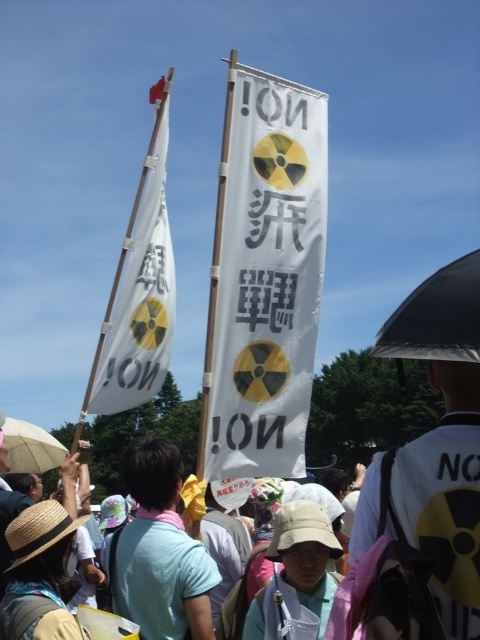
Which of these two, white paper banner at center or white paper flag at upper left, stands taller?

Standing taller between the two is white paper banner at center.

Does white paper banner at center have a smaller size compared to white paper flag at upper left?

No, white paper banner at center is not smaller than white paper flag at upper left.

Image resolution: width=480 pixels, height=640 pixels. What do you see at coordinates (264, 276) in the screenshot?
I see `white paper banner at center` at bounding box center [264, 276].

At what (x,y) coordinates should I click in order to perform the action: click on white paper banner at center. Please return your answer as a coordinate pair (x, y). This screenshot has width=480, height=640. Looking at the image, I should click on (264, 276).

Does white paper banner at center appear on the left side of beige fabric umbrella at lower left?

Incorrect, white paper banner at center is not on the left side of beige fabric umbrella at lower left.

Who is taller, white paper banner at center or beige fabric umbrella at lower left?

white paper banner at center is taller.

Which is in front, point (309, 225) or point (20, 454)?

Positioned in front is point (309, 225).

In order to click on white paper banner at center in this screenshot , I will do `click(264, 276)`.

The width and height of the screenshot is (480, 640). I want to click on light blue cotton shirt at center, so click(160, 550).

Can you confirm if light blue cotton shirt at center is thinner than beige fabric umbrella at lower left?

Incorrect, light blue cotton shirt at center's width is not less than beige fabric umbrella at lower left's.

Does point (116, 570) come behind point (39, 445)?

No.

You are a GUI agent. You are given a task and a screenshot of the screen. Output one action in this format:
    pyautogui.click(x=<x>, y=<y>)
    Task: Click on the light blue cotton shirt at center
    The image size is (480, 640).
    Given the screenshot: What is the action you would take?
    pyautogui.click(x=160, y=550)